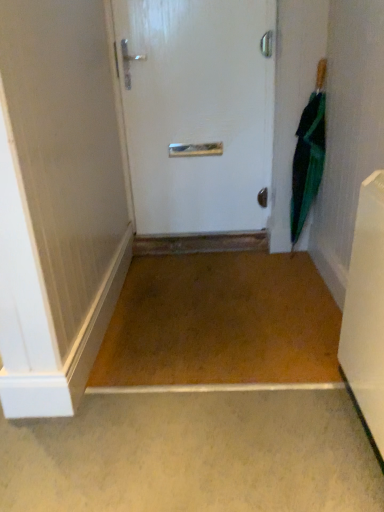
Locate an element on the screen. The height and width of the screenshot is (512, 384). free region on the left part of green matte umbrella at right is located at coordinates (260, 266).